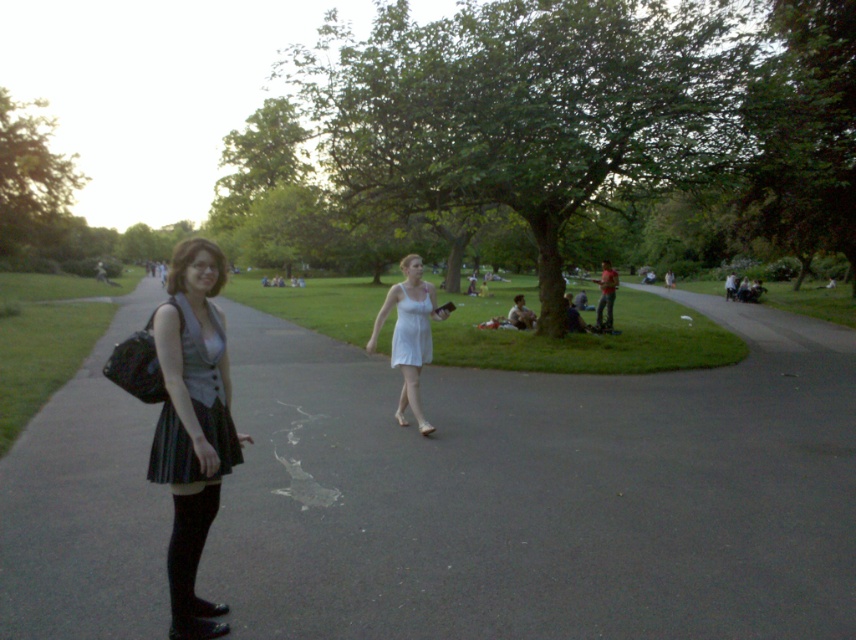
You are standing at the center of the park and want to walk towards the black asphalt pavement at lower left. Which direction should you head?

A: Since the black asphalt pavement at lower left is located at point (541, 493), you should head towards the lower left direction from your current position at the center of the park.

You are standing at the point labeled point [263,536] and want to walk towards the point labeled point [605,266]. Which direction should you move to get closer to your destination?

To move from point [263,536] towards point [605,266], you should move upwards and to the left since point [605,266] is further away from the camera compared to your current position at point [263,536].

You are a photographer standing at the edge of the park pathway. You want to take a photo that includes both the white matte dress at center and the green fabric jacket at center. Given that your camera has a maximum focus range of 30 feet, will you be able to capture both subjects in sharp focus?

The white matte dress at center and green fabric jacket at center are 32.43 feet apart from each other, which exceeds the camera maximum focus range of 30 feet. Therefore, you cannot capture both subjects in sharp focus.